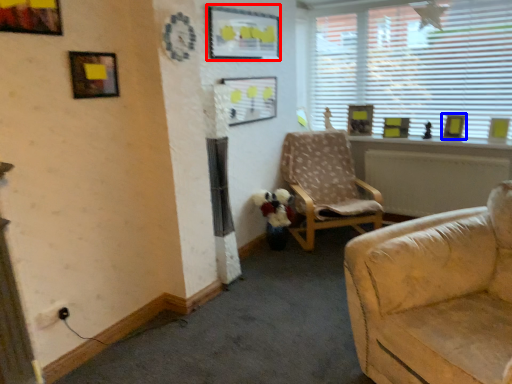
Question: Among these objects, which one is farthest to the camera, picture frame (highlighted by a red box) or picture frame (highlighted by a blue box)?

Choices:
 (A) picture frame
 (B) picture frame

Answer: (B)